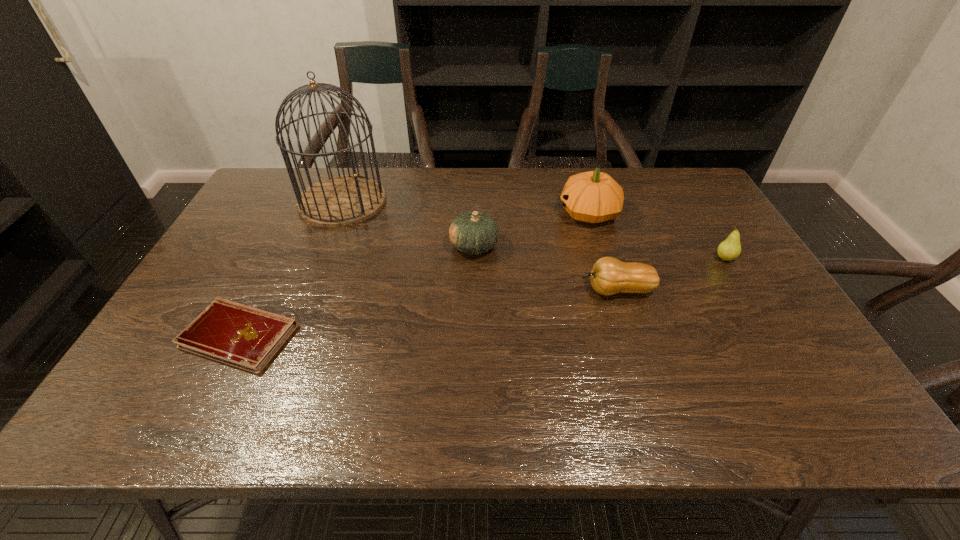
In order to click on free spot between the nearest gourd and the rightmost object in this screenshot , I will do `click(671, 274)`.

Find the location of a particular element. Image resolution: width=960 pixels, height=540 pixels. free spot between the tallest gourd and the fourth object from right to left is located at coordinates (532, 230).

The image size is (960, 540). I want to click on vacant point located between the third object from left to right and the nearest gourd, so click(x=545, y=268).

The width and height of the screenshot is (960, 540). I want to click on vacant point located between the nearest gourd and the notebook, so click(x=428, y=313).

Where is `free spot between the third object from left to right and the nearest gourd`? free spot between the third object from left to right and the nearest gourd is located at coordinates (545, 268).

Find the location of `free spot between the nearest gourd and the fifth shortest object`. free spot between the nearest gourd and the fifth shortest object is located at coordinates (603, 252).

The width and height of the screenshot is (960, 540). I want to click on object that is the fifth closest to the shortest object, so click(730, 249).

Identify which object is the fifth closest to the third object from left to right. Please provide its 2D coordinates. Your answer should be formatted as a tuple, i.e. [(x, y)], where the tuple contains the x and y coordinates of a point satisfying the conditions above.

[(730, 249)]

Locate an element on the screen. gourd that is the second nearest to the birdcage is located at coordinates (592, 197).

Choose which gourd is the third nearest neighbor to the pear. Please provide its 2D coordinates. Your answer should be formatted as a tuple, i.e. [(x, y)], where the tuple contains the x and y coordinates of a point satisfying the conditions above.

[(473, 232)]